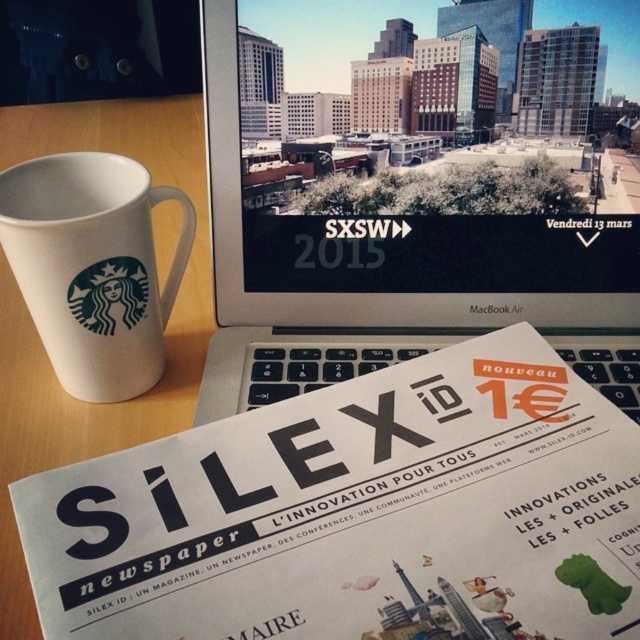
Can you confirm if silver metallic laptop at center is taller than white ceramic mug at left?

Correct, silver metallic laptop at center is much taller as white ceramic mug at left.

Locate an element on the screen. silver metallic laptop at center is located at coordinates (397, 250).

Identify the location of silver metallic laptop at center. The height and width of the screenshot is (640, 640). (397, 250).

Can you confirm if white glossy newspaper at center is positioned above silver metallic laptop at center?

Actually, white glossy newspaper at center is below silver metallic laptop at center.

This screenshot has height=640, width=640. What do you see at coordinates (358, 513) in the screenshot?
I see `white glossy newspaper at center` at bounding box center [358, 513].

You are a GUI agent. You are given a task and a screenshot of the screen. Output one action in this format:
    pyautogui.click(x=<x>, y=<y>)
    Task: Click on the white glossy newspaper at center
    
    Given the screenshot: What is the action you would take?
    pyautogui.click(x=358, y=513)

Between white glossy newspaper at center and white ceramic mug at left, which one has more height?

Standing taller between the two is white ceramic mug at left.

Is white glossy newspaper at center to the left of white ceramic mug at left from the viewer's perspective?

In fact, white glossy newspaper at center is to the right of white ceramic mug at left.

Which is in front, point (444, 476) or point (152, 346)?

Point (444, 476) is more forward.

This screenshot has width=640, height=640. In order to click on white glossy newspaper at center in this screenshot , I will do `click(358, 513)`.